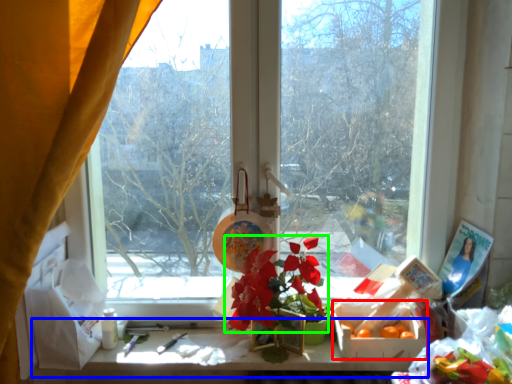
Question: Which is farther away from flower box (highlighted by a red box)? table (highlighted by a blue box) or flower (highlighted by a green box)?

Choices:
 (A) table
 (B) flower

Answer: (B)